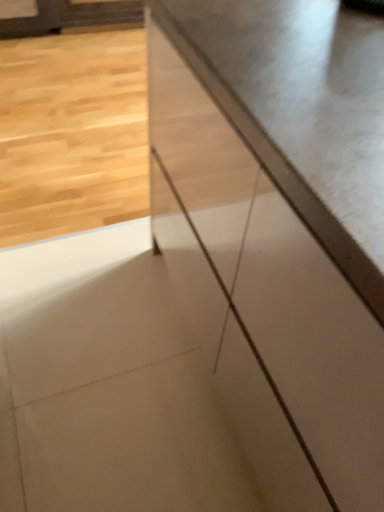
Find the location of `vacant space situated on the left part of satin silver cabinet at center`. vacant space situated on the left part of satin silver cabinet at center is located at coordinates (90, 314).